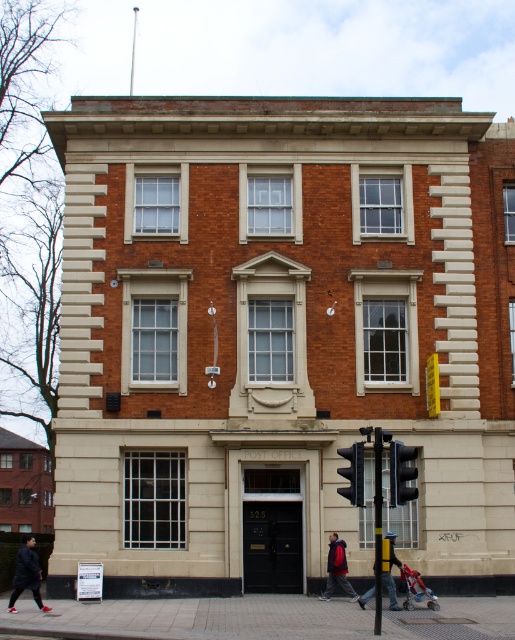
Question: Does black plastic traffic light at lower right lie behind yellow plastic traffic light at center?

Choices:
 (A) yes
 (B) no

Answer: (A)

Question: Observing the image, what is the correct spatial positioning of black plastic traffic light at lower right in reference to yellow plastic traffic light at center?

Choices:
 (A) below
 (B) above

Answer: (B)

Question: Which object is closer to the camera taking this photo?

Choices:
 (A) black matte traffic light at lower right
 (B) black plastic traffic light at lower right

Answer: (B)

Question: Which point is closer to the camera taking this photo?

Choices:
 (A) (392, 492)
 (B) (327, 566)
 (C) (386, 579)

Answer: (A)

Question: Is black matte traffic light at lower right to the right of red jacket at center from the viewer's perspective?

Choices:
 (A) yes
 (B) no

Answer: (A)

Question: Which point is closer to the camera?

Choices:
 (A) dark gray jacket at lower left
 (B) black matte traffic light at lower right

Answer: (B)